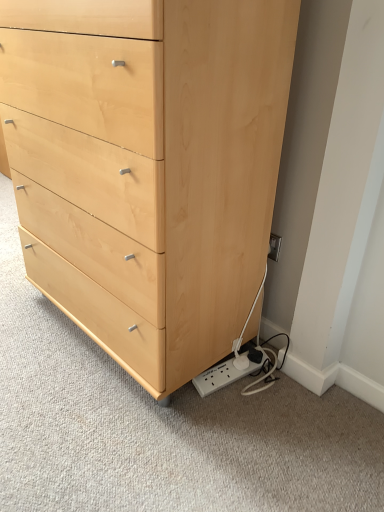
The image size is (384, 512). In order to click on vacant area that lies to the right of white plastic power strip at lower right in this screenshot , I will do `click(278, 395)`.